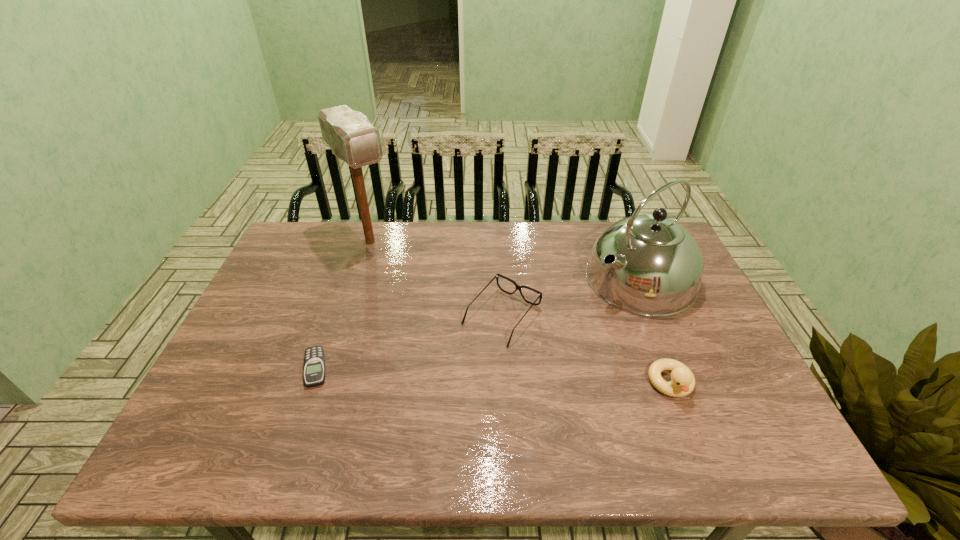
You are a GUI agent. You are given a task and a screenshot of the screen. Output one action in this format:
    pyautogui.click(x=<x>, y=<y>)
    Task: Click on the duckling located at the right edge
    The height and width of the screenshot is (540, 960).
    Given the screenshot: What is the action you would take?
    pyautogui.click(x=682, y=383)

Identify the location of kettle present at the right edge. (658, 270).

The width and height of the screenshot is (960, 540). What are the coordinates of `object that is at the far right corner` in the screenshot? It's located at (658, 270).

Image resolution: width=960 pixels, height=540 pixels. Identify the location of object that is positioned at the near right corner. (682, 383).

This screenshot has height=540, width=960. In the image, there is a desktop. Identify the location of vacant space at the far edge. (444, 233).

At what (x,y) coordinates should I click in order to perform the action: click on vacant point at the near edge. Please return your answer as a coordinate pair (x, y). Image resolution: width=960 pixels, height=540 pixels. Looking at the image, I should click on (570, 395).

You are a GUI agent. You are given a task and a screenshot of the screen. Output one action in this format:
    pyautogui.click(x=<x>, y=<y>)
    Task: Click on the vacant space at the left edge of the desktop
    The height and width of the screenshot is (540, 960).
    Given the screenshot: What is the action you would take?
    pyautogui.click(x=274, y=381)

At what (x,y) coordinates should I click in order to perform the action: click on vacant space at the right edge of the desktop. Please return your answer as a coordinate pair (x, y). Looking at the image, I should click on (710, 338).

Locate an element on the screen. vacant space at the far left corner of the desktop is located at coordinates (328, 236).

Identify the location of free location at the near right corner of the desktop. (767, 420).